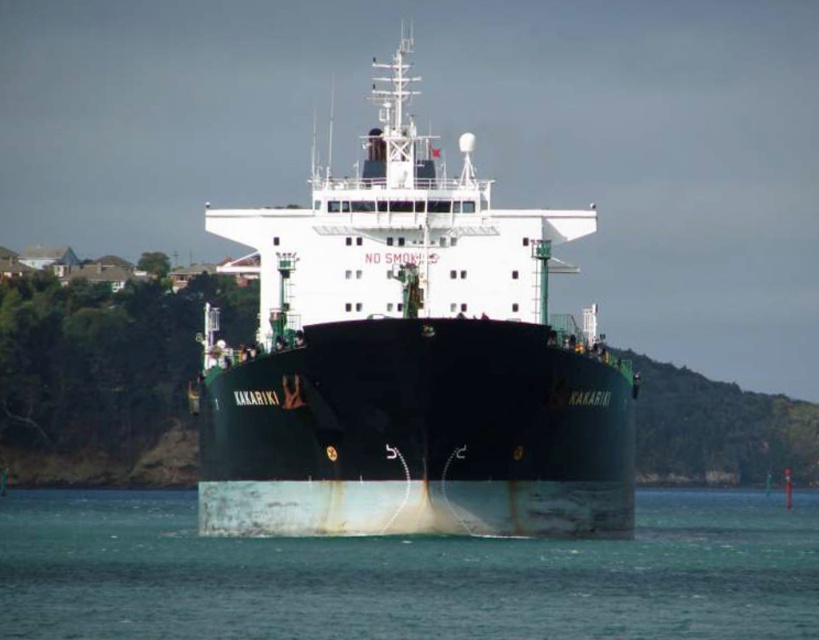
You are a marine biologist observing the Kakariki from a nearby research vessel. You need to record the exact coordinates of the green matte ship at center in the image. What are its coordinates?

The green matte ship at center is located at coordinates point (410, 362).

You are a maritime inspector observing the Kakariki cargo ship. You notice the green matte ship at center and the white matte water at center. Which object is positioned higher in the image?

The green matte ship at center is located above the white matte water at center, so it is positioned higher in the image.

You are a marine biologist observing the Kakariki cargo ship from a small boat. You need to collect water samples from an area 15 meters away from the ship. Can you safely collect the samples between the green matte ship at center and the white matte water at center without getting too close?

The distance between the green matte ship at center and the white matte water at center is 16.50 meters. Since you need to collect samples at 15 meters from the ship, you can safely do so within this space as 15 meters is less than the 16.50 meters separation available.